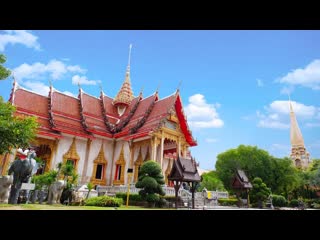
What are the coordinates of `windows` in the screenshot? It's located at (120, 175), (98, 171), (74, 166).